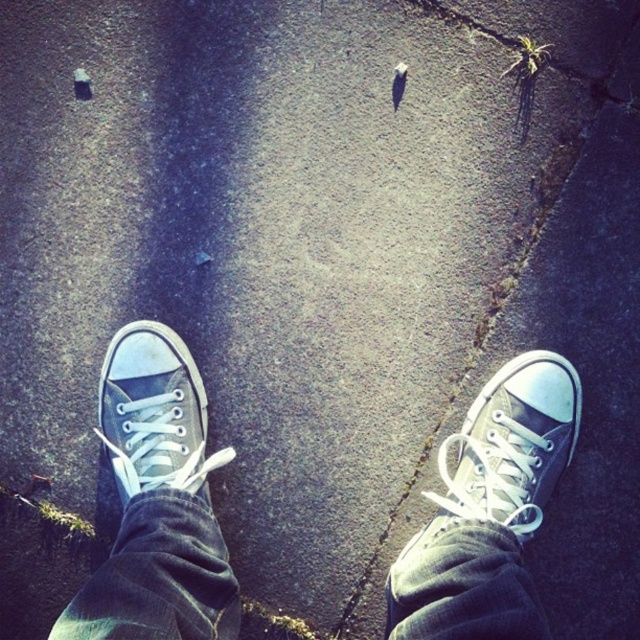
You are a photographer trying to capture the green canvas shoe at center in the image. Based on its position, where should you aim your camera to ensure it is centered in the frame?

The green canvas shoe at center is located at coordinates point [488,509], so you should aim your camera at that point to center it in the frame.

You are a shoe designer analyzing the image. You need to determine which shoe is wider between the white canvas sneakers at center and the gray canvas shoe at center. According to the scene, which one is wider?

The white canvas sneakers at center is wider than the gray canvas shoe at center as stated in the objects description.

You are standing at the edge of the pavement where the feet are shown. You want to place a small marker at the exact location of point (488, 509). Based on the scene description, where should you place the marker relative to the green canvas shoe at center?

The point (488, 509) is located on the green canvas shoe at center, so you should place the marker directly on the green canvas shoe at center.